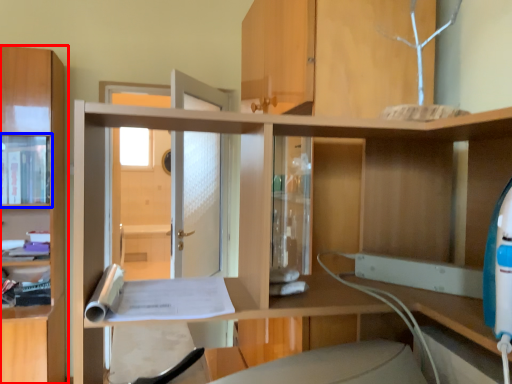
Question: Which point is further to the camera, cabinetry (highlighted by a red box) or cabinet (highlighted by a blue box)?

Choices:
 (A) cabinetry
 (B) cabinet

Answer: (B)